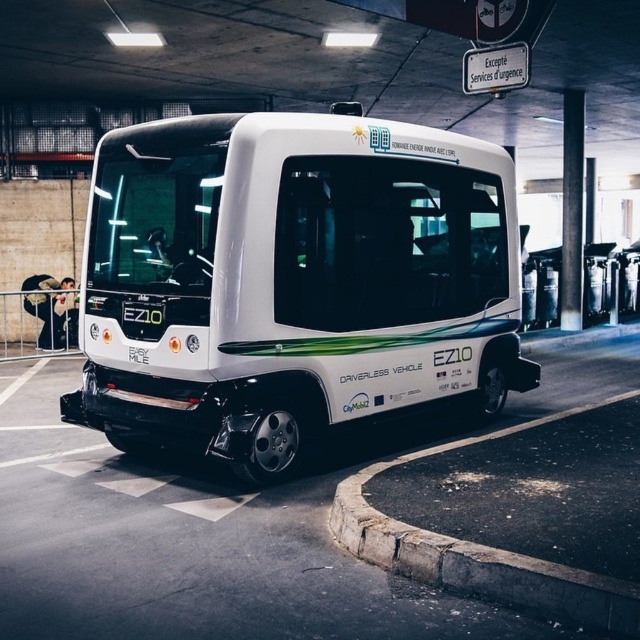
Question: Does white matte driverless vehicle at center appear on the left side of white glossy driverless vehicle at center?

Choices:
 (A) no
 (B) yes

Answer: (B)

Question: Among these points, which one is nearest to the camera?

Choices:
 (A) (154, 326)
 (B) (252, 612)
 (C) (476, 563)

Answer: (B)

Question: Which object is the closest to the white matte driverless vehicle at center?

Choices:
 (A) concrete at lower right
 (B) white glossy driverless vehicle at center

Answer: (B)

Question: Among these points, which one is farthest from the camera?

Choices:
 (A) (184, 380)
 (B) (620, 333)

Answer: (B)

Question: Is white matte driverless vehicle at center to the left of white glossy driverless vehicle at center from the viewer's perspective?

Choices:
 (A) yes
 (B) no

Answer: (A)

Question: Is the position of white matte driverless vehicle at center more distant than that of white glossy driverless vehicle at center?

Choices:
 (A) yes
 (B) no

Answer: (A)